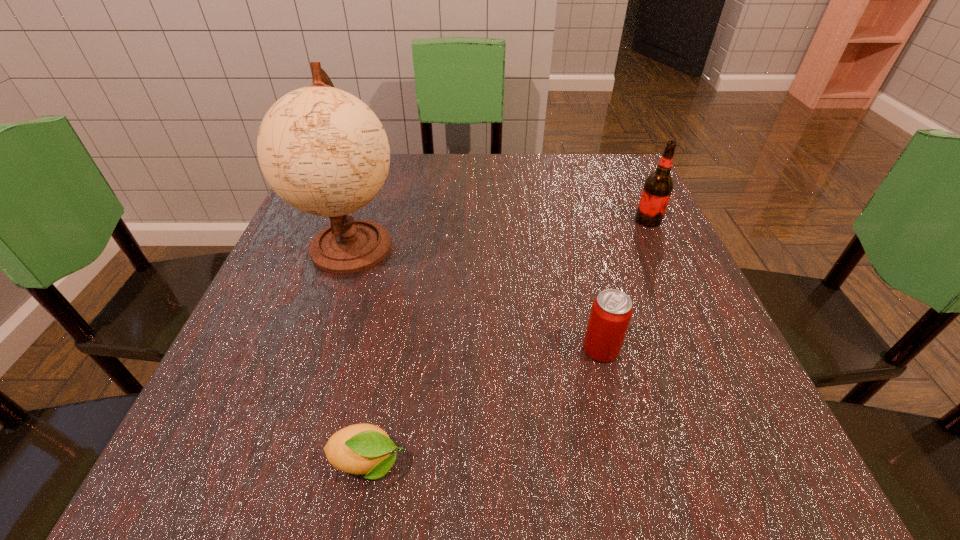
Where is `free space at the near right corner of the desktop`? free space at the near right corner of the desktop is located at coordinates click(721, 476).

Find the location of `vacant space that is in between the root beer and the tallest object`. vacant space that is in between the root beer and the tallest object is located at coordinates (500, 233).

The image size is (960, 540). I want to click on empty space that is in between the shortest object and the globe, so click(x=359, y=355).

Locate an element on the screen. Image resolution: width=960 pixels, height=540 pixels. free spot between the third shortest object and the tallest object is located at coordinates (500, 233).

Identify the location of vacant area that lies between the lemon and the third shortest object. The width and height of the screenshot is (960, 540). (508, 342).

What are the coordinates of `blank region between the shortest object and the rightmost object` in the screenshot? It's located at click(508, 342).

The height and width of the screenshot is (540, 960). Identify the location of free space between the globe and the shortest object. (359, 355).

You are a GUI agent. You are given a task and a screenshot of the screen. Output one action in this format:
    pyautogui.click(x=<x>, y=<y>)
    Task: Click on the free area in between the root beer and the tallest object
    The height and width of the screenshot is (540, 960).
    Given the screenshot: What is the action you would take?
    pyautogui.click(x=500, y=233)

You are a GUI agent. You are given a task and a screenshot of the screen. Output one action in this format:
    pyautogui.click(x=<x>, y=<y>)
    Task: Click on the vacant space in between the lemon and the second nearest object
    
    Given the screenshot: What is the action you would take?
    pyautogui.click(x=484, y=406)

Where is `vacant space that is in between the tallest object and the nearest object`? The height and width of the screenshot is (540, 960). vacant space that is in between the tallest object and the nearest object is located at coordinates (359, 355).